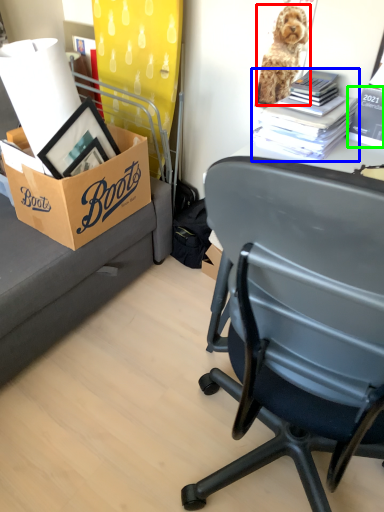
Question: Which object is positioned closest to dog (highlighted by a red box)? Select from book (highlighted by a blue box) and book (highlighted by a green box).

Choices:
 (A) book
 (B) book

Answer: (A)